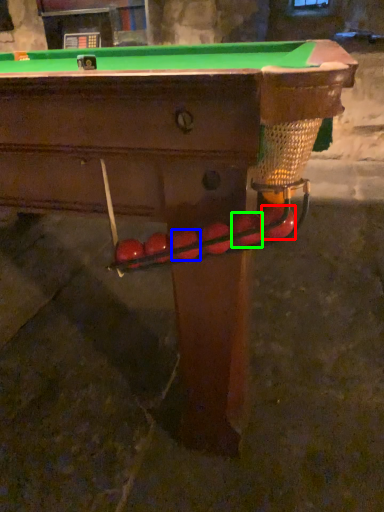
Question: Which is farther away from fruit (highlighted by a red box)? fruit (highlighted by a blue box) or fruit (highlighted by a green box)?

Choices:
 (A) fruit
 (B) fruit

Answer: (A)